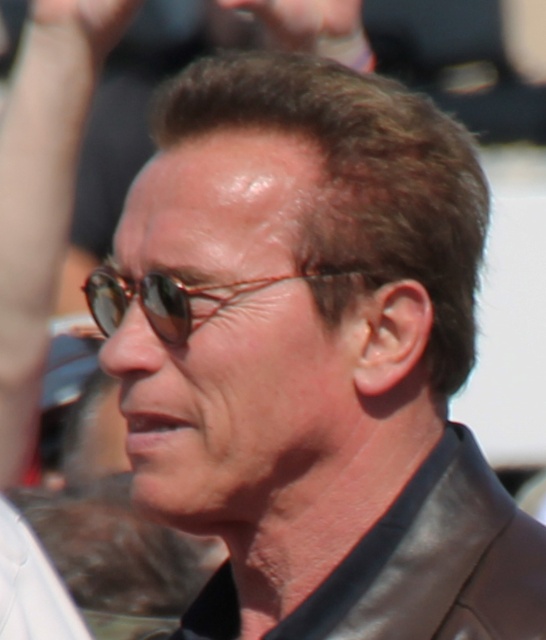
Does point (502, 602) come closer to viewer compared to point (209, 284)?

That is True.

You are a GUI agent. You are given a task and a screenshot of the screen. Output one action in this format:
    pyautogui.click(x=<x>, y=<y>)
    Task: Click on the leather jacket at center
    The image size is (546, 640).
    Given the screenshot: What is the action you would take?
    pyautogui.click(x=436, y=563)